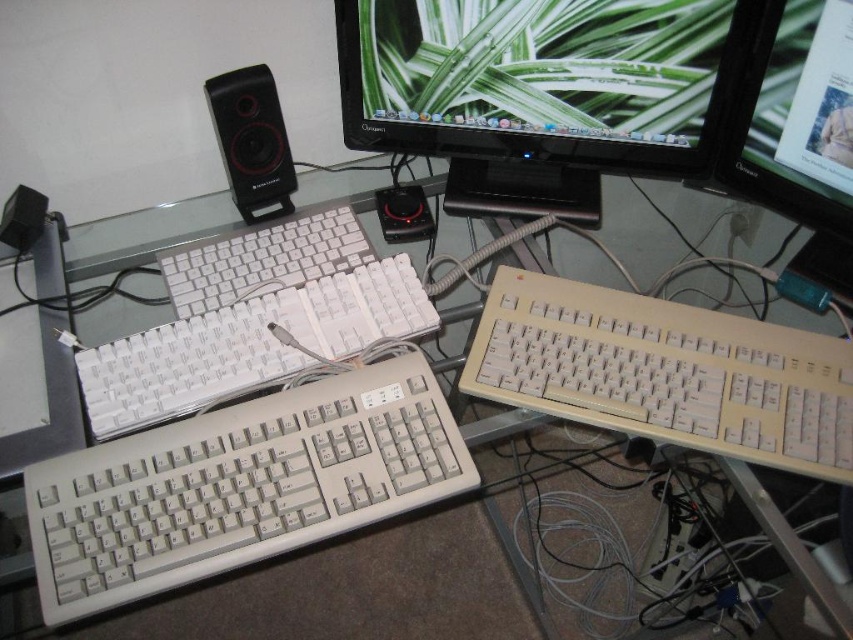
Question: Can you confirm if matte plastic monitor at upper center is positioned above white matte keyboard at center?

Choices:
 (A) no
 (B) yes

Answer: (B)

Question: Can you confirm if beige plastic keyboard at lower left is positioned to the right of matte plastic monitor at upper center?

Choices:
 (A) yes
 (B) no

Answer: (B)

Question: Which point is closer to the camera?

Choices:
 (A) (263, 102)
 (B) (292, 268)
 (C) (622, 422)
 (D) (299, 356)

Answer: (C)

Question: Among these points, which one is farthest from the camera?

Choices:
 (A) (254, 209)
 (B) (36, 499)
 (C) (306, 244)
 (D) (282, 312)

Answer: (A)

Question: Does beige plastic keyboard at lower right have a lesser width compared to white plastic keyboard at center?

Choices:
 (A) no
 (B) yes

Answer: (A)

Question: Which object is positioned closest to the matte plastic monitor at upper center?

Choices:
 (A) white matte keyboard at center
 (B) white plastic keyboard at center

Answer: (A)